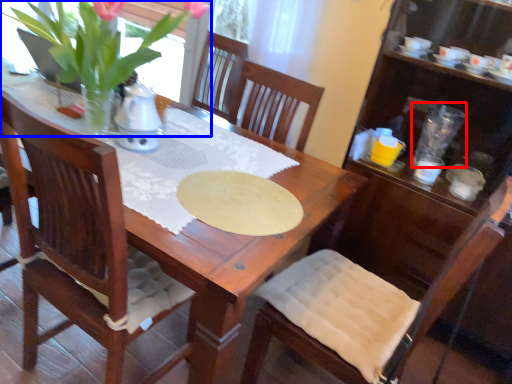
Question: Which point is further to the camera, tableware (highlighted by a red box) or houseplant (highlighted by a blue box)?

Choices:
 (A) tableware
 (B) houseplant

Answer: (A)